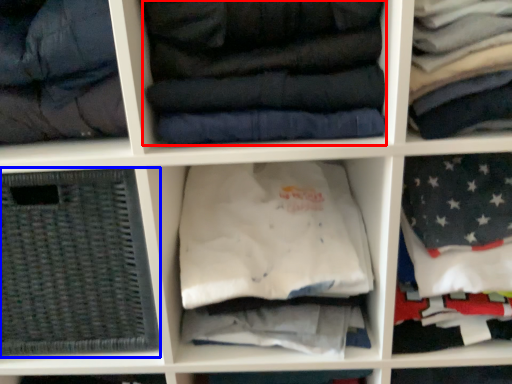
Question: Which of the following is the farthest to the observer, clothing (highlighted by a red box) or basket (highlighted by a blue box)?

Choices:
 (A) clothing
 (B) basket

Answer: (B)